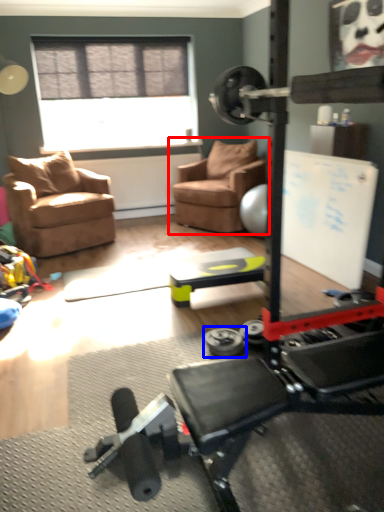
Question: Which of the following is the closest to the observer, chair (highlighted by a red box) or dumbbell (highlighted by a blue box)?

Choices:
 (A) chair
 (B) dumbbell

Answer: (B)